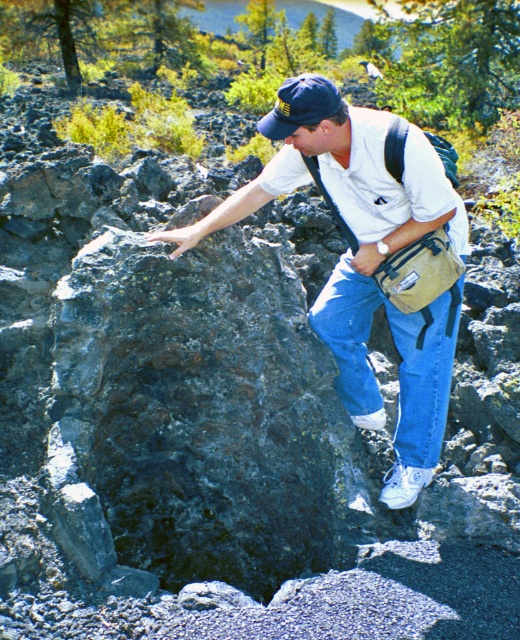
You are a fashion designer observing a person wearing a white cotton shirt at center and a blue fabric baseball cap at center. You need to design a new clothing line that accommodates the space between these two items. What is the minimum vertical space required between the collar of the shirt and the brim of the hat to ensure comfort?

The minimum vertical space required between the collar of the white cotton shirt at center and the brim of the blue fabric baseball cap at center should be at least 78.61 centimeters to ensure comfort.

You are a photographer trying to capture the person in the image from above. Which object, the white cotton shirt at center or the blue fabric baseball cap at center, will appear smaller in your photo?

The white cotton shirt at center is shorter than the blue fabric baseball cap at center, so it will appear smaller in the photo.

You are a photographer wanting to capture the person in the image while ensuring both the white cotton shirt at center and the blue fabric baseball cap at center are visible. Since the person is facing the rock formation, where should you position yourself relative to the person to include both items in the frame?

Position yourself to the right of the person so that the white cotton shirt at center, which is to the left of the blue fabric baseball cap at center, remains visible in the frame.